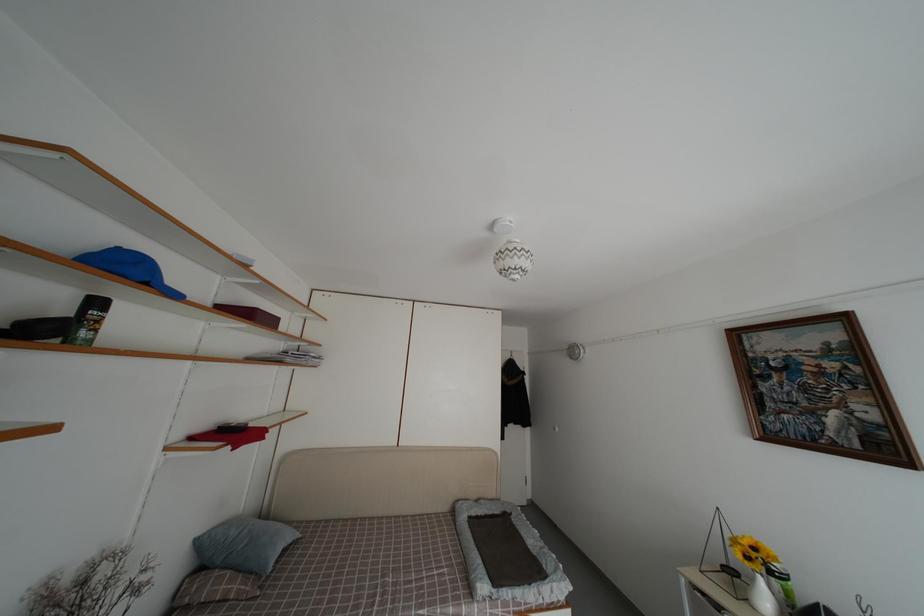
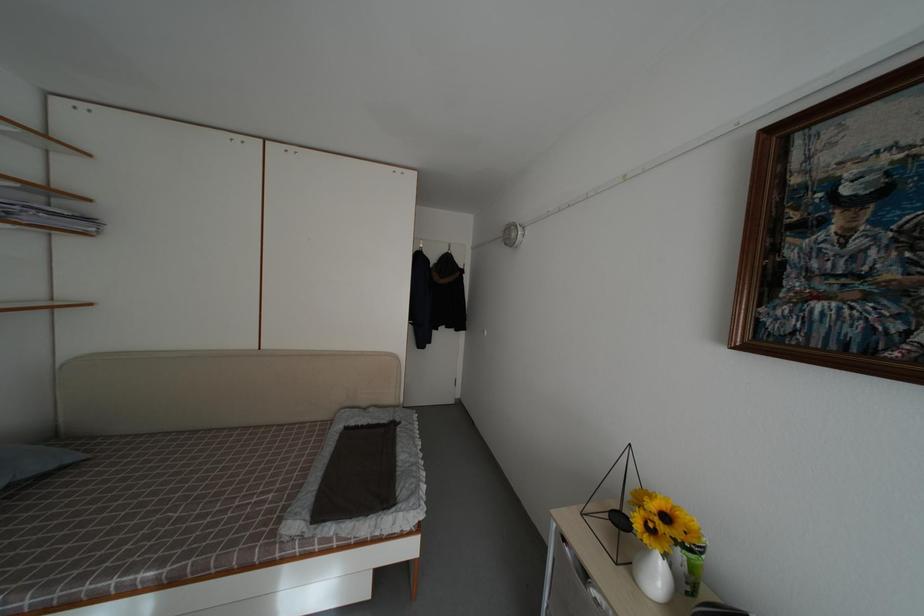
Locate, in the second image, the point that corresponds to point (323, 363) in the first image.

(94, 225)